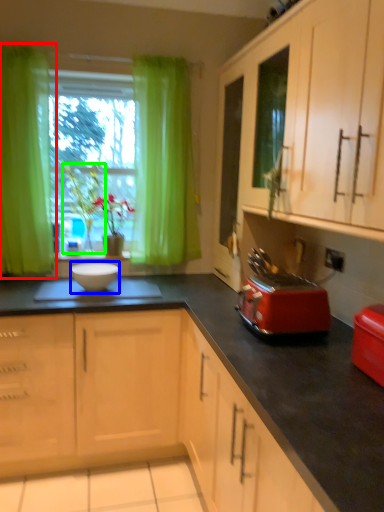
Question: Estimate the real-world distances between objects in this image. Which object is farther from curtain (highlighted by a red box), mixing bowl (highlighted by a blue box) or plant (highlighted by a green box)?

Choices:
 (A) mixing bowl
 (B) plant

Answer: (A)